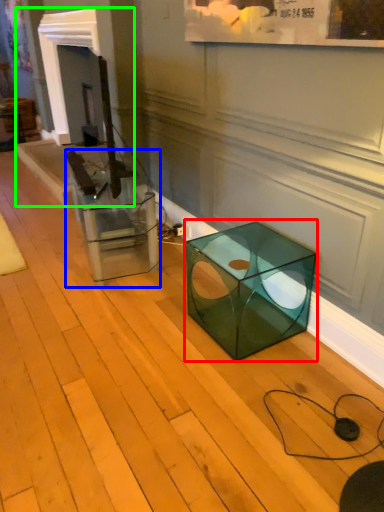
Question: Which object is positioned closest to table (highlighted by a red box)? Select from glass box (highlighted by a blue box) and fireplace (highlighted by a green box).

Choices:
 (A) glass box
 (B) fireplace

Answer: (A)